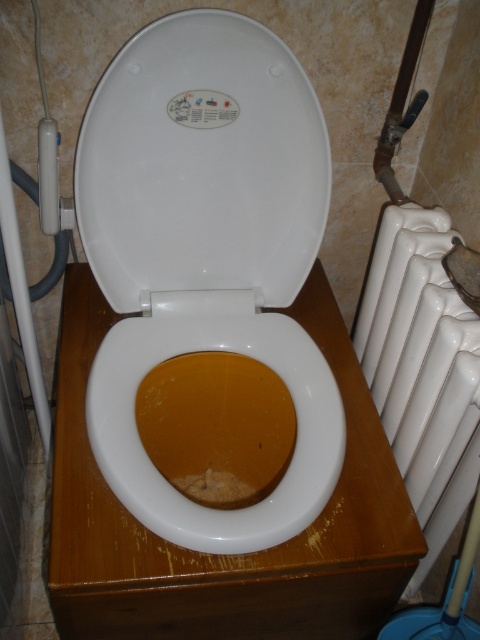
You are a plumber who needs to inspect the toilet. You are standing at a distance of 30.93 inches from the white glossy toilet seat at center. Can you reach it without moving closer?

The distance between you and the white glossy toilet seat at center is 30.93 inches, which is approximately 2.58 feet. Since plumbers typically need to be within arm reach to inspect a toilet, which is around 2 feet or less, you would need to move closer to effectively inspect it.

You are a plumber inspecting the bathroom. You need to access the pipe behind the brown matte toilet bowl at center and the white glossy radiator at right. Which object should you move first?

The brown matte toilet bowl at center is in front of the white glossy radiator at right, so you should move the brown matte toilet bowl at center first to access the pipe behind both objects.

From the picture: You are a plumber inspecting a bathroom. You see the white glossy toilet seat at center and the white glossy radiator at right. Which object is wider?

The white glossy toilet seat at center is wider than the white glossy radiator at right.